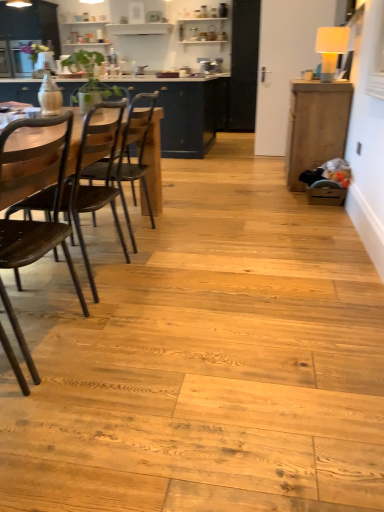
Question: Does wooden cabinet at right, marked as the 1th cabinetry in a front-to-back arrangement, have a greater width compared to dark wood chair at left, positioned as the second chair in back-to-front order?

Choices:
 (A) yes
 (B) no

Answer: (B)

Question: Considering the relative sizes of wooden cabinet at right, which ranks as the 1th cabinetry in right-to-left order, and dark wood chair at left, positioned as the second chair in back-to-front order, in the image provided, is wooden cabinet at right, which ranks as the 1th cabinetry in right-to-left order, shorter than dark wood chair at left, positioned as the second chair in back-to-front order,?

Choices:
 (A) yes
 (B) no

Answer: (B)

Question: Does wooden cabinet at right, which ranks as the 1th cabinetry in right-to-left order, have a lesser width compared to dark wood chair at left, the 2th chair viewed from the front?

Choices:
 (A) no
 (B) yes

Answer: (B)

Question: From a real-world perspective, is wooden cabinet at right, which ranks as the 1th cabinetry in right-to-left order, located higher than dark wood chair at left, the 2th chair viewed from the front?

Choices:
 (A) yes
 (B) no

Answer: (A)

Question: Is wooden cabinet at right, marked as the 1th cabinetry in a front-to-back arrangement, positioned with its back to dark wood chair at left, the 2th chair viewed from the front?

Choices:
 (A) yes
 (B) no

Answer: (B)

Question: From the image's perspective, is wooden cabinet at right, acting as the 2th cabinetry starting from the left, located beneath dark wood chair at left, the 2th chair viewed from the front?

Choices:
 (A) yes
 (B) no

Answer: (B)

Question: Is wooden chair at left, acting as the first chair starting from the back, positioned in front of matte dark wood cabinet at center, the first cabinetry positioned from the left?

Choices:
 (A) yes
 (B) no

Answer: (A)

Question: Is wooden chair at left, positioned as the 3th chair in front-to-back order, thinner than matte dark wood cabinet at center, the second cabinetry positioned from the front?

Choices:
 (A) yes
 (B) no

Answer: (A)

Question: Are wooden chair at left, acting as the first chair starting from the back, and matte dark wood cabinet at center, arranged as the 1th cabinetry when viewed from the back, beside each other?

Choices:
 (A) yes
 (B) no

Answer: (B)

Question: Does wooden chair at left, acting as the first chair starting from the back, have a greater height compared to matte dark wood cabinet at center, the first cabinetry positioned from the left?

Choices:
 (A) no
 (B) yes

Answer: (A)

Question: From a real-world perspective, is wooden chair at left, acting as the first chair starting from the back, positioned under matte dark wood cabinet at center, the second cabinetry positioned from the front, based on gravity?

Choices:
 (A) no
 (B) yes

Answer: (B)

Question: From the image's perspective, is wooden chair at left, acting as the first chair starting from the back, beneath matte dark wood cabinet at center, arranged as the 1th cabinetry when viewed from the back?

Choices:
 (A) yes
 (B) no

Answer: (A)

Question: Can you confirm if matte dark wood cabinet at center, which ranks as the 2th cabinetry in right-to-left order, is wider than dark brown wood chair at left, which is counted as the 3th chair, starting from the back?

Choices:
 (A) no
 (B) yes

Answer: (B)